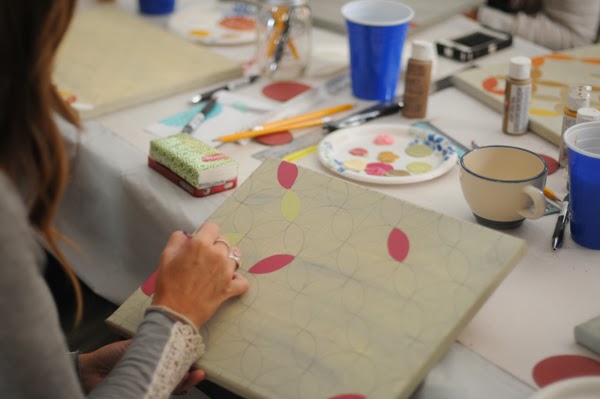
Image resolution: width=600 pixels, height=399 pixels. Identify the location of plate. (445, 158).